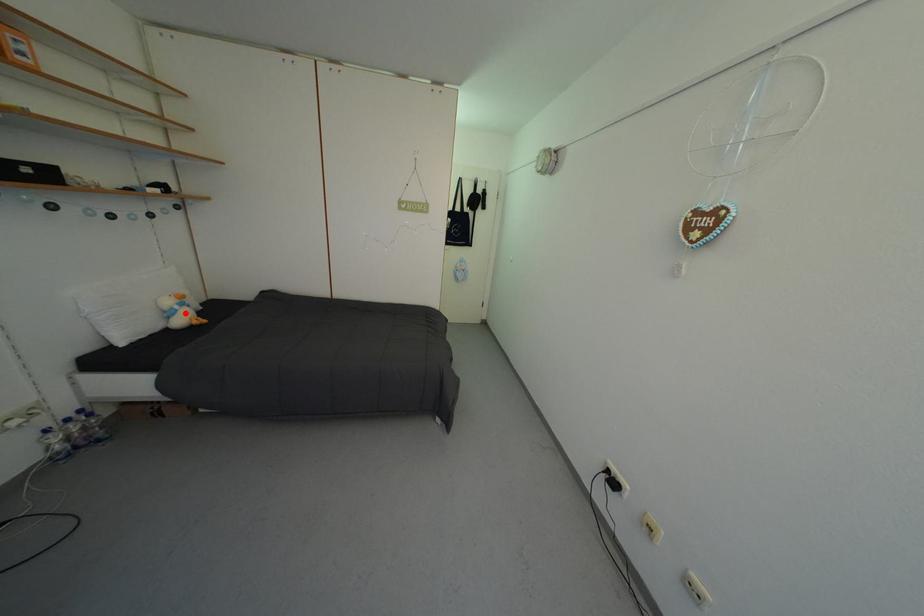
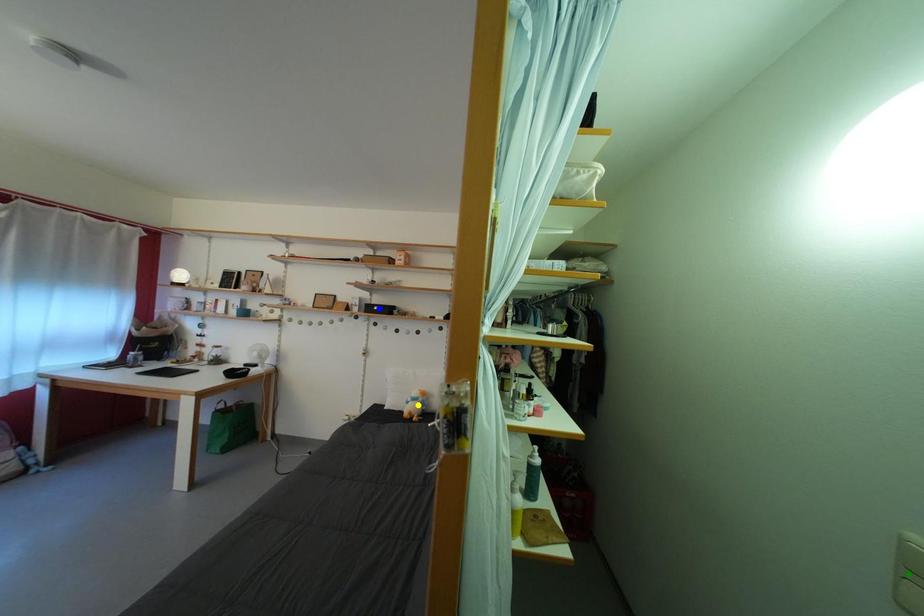
Question: I am providing you with two images of the same scene from different viewpoints. A red point is marked on the first image. You are given multiple points on the second image. Can you choose the point in image 2 that corresponds to the point in image 1?

Choices:
 (A) yellow point
 (B) green point
 (C) blue point

Answer: (A)